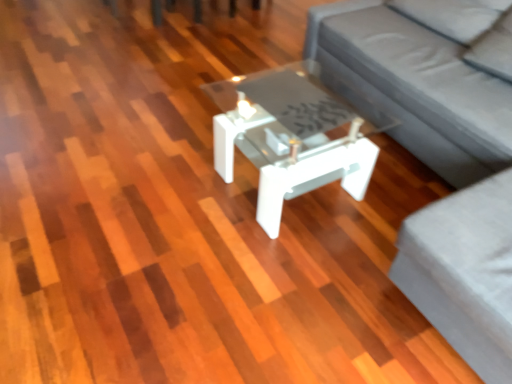
Question: Does gray fabric couch at center have a lesser height compared to white glossy coffee table at center?

Choices:
 (A) yes
 (B) no

Answer: (B)

Question: Considering the relative sizes of gray fabric couch at center and white glossy coffee table at center in the image provided, is gray fabric couch at center bigger than white glossy coffee table at center?

Choices:
 (A) no
 (B) yes

Answer: (B)

Question: Is gray fabric couch at center to the right of white glossy coffee table at center from the viewer's perspective?

Choices:
 (A) no
 (B) yes

Answer: (B)

Question: From the image's perspective, is gray fabric couch at center under white glossy coffee table at center?

Choices:
 (A) no
 (B) yes

Answer: (A)

Question: Are gray fabric couch at center and white glossy coffee table at center beside each other?

Choices:
 (A) yes
 (B) no

Answer: (B)

Question: Does gray fabric couch at center have a lesser width compared to white glossy coffee table at center?

Choices:
 (A) no
 (B) yes

Answer: (A)

Question: Is gray fabric couch at center facing away from gray fabric couch at center?

Choices:
 (A) no
 (B) yes

Answer: (B)

Question: Does gray fabric couch at center have a greater height compared to gray fabric couch at center?

Choices:
 (A) yes
 (B) no

Answer: (A)

Question: Is gray fabric couch at center further to camera compared to gray fabric couch at center?

Choices:
 (A) no
 (B) yes

Answer: (A)

Question: Does gray fabric couch at center have a greater width compared to gray fabric couch at center?

Choices:
 (A) yes
 (B) no

Answer: (A)

Question: Is gray fabric couch at center smaller than gray fabric couch at center?

Choices:
 (A) yes
 (B) no

Answer: (B)

Question: Does gray fabric couch at center turn towards gray fabric couch at center?

Choices:
 (A) no
 (B) yes

Answer: (B)

Question: Considering the relative positions of gray fabric couch at center and gray fabric couch at center in the image provided, is gray fabric couch at center behind gray fabric couch at center?

Choices:
 (A) yes
 (B) no

Answer: (A)